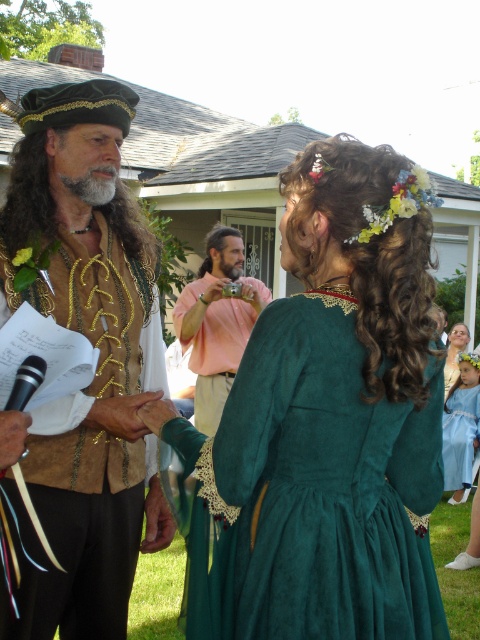
Can you confirm if pink cotton shirt at center is positioned to the right of graywoollybeard at left?

Correct, you'll find pink cotton shirt at center to the right of graywoollybeard at left.

This screenshot has height=640, width=480. Describe the element at coordinates (216, 326) in the screenshot. I see `pink cotton shirt at center` at that location.

At what (x,y) coordinates should I click in order to perform the action: click on pink cotton shirt at center. Please return your answer as a coordinate pair (x, y). The image size is (480, 640). Looking at the image, I should click on (216, 326).

Which is below, graywoollybeard at left or emerald velvet dress at center?

emerald velvet dress at center

Does point (64, 182) come in front of point (454, 324)?

Yes, it is in front of point (454, 324).

You are a GUI agent. You are given a task and a screenshot of the screen. Output one action in this format:
    pyautogui.click(x=<x>, y=<y>)
    Task: Click on the graywoollybeard at left
    
    Given the screenshot: What is the action you would take?
    pyautogui.click(x=93, y=184)

Is brown curly hair at center to the left of floral fabric headband at upper right from the viewer's perspective?

Yes, brown curly hair at center is to the left of floral fabric headband at upper right.

Who is more distant from viewer, (214, 246) or (477, 364)?

The point (477, 364) is more distant.

Between point (205, 269) and point (460, 372), which one is positioned in front?

Point (205, 269) is more forward.

I want to click on brown curly hair at center, so click(x=216, y=244).